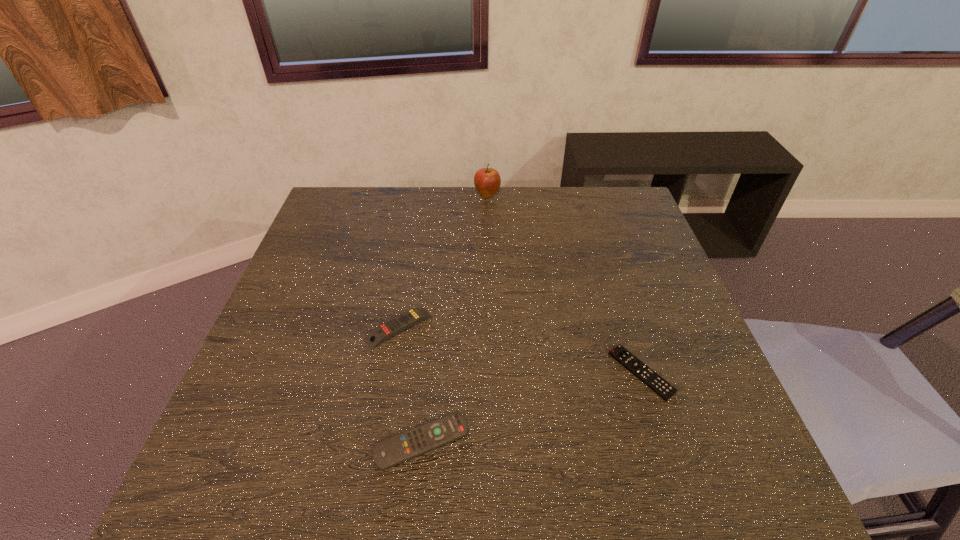
The width and height of the screenshot is (960, 540). In order to click on the second object from right to left in this screenshot , I will do `click(487, 181)`.

Image resolution: width=960 pixels, height=540 pixels. I want to click on apple, so [x=487, y=181].

Find the location of a particular element. The width and height of the screenshot is (960, 540). the tallest remote control is located at coordinates (390, 328).

The height and width of the screenshot is (540, 960). Identify the location of the nearest object. [x=392, y=451].

You are a GUI agent. You are given a task and a screenshot of the screen. Output one action in this format:
    pyautogui.click(x=<x>, y=<y>)
    Task: Click on the third tallest object
    The width and height of the screenshot is (960, 540).
    Given the screenshot: What is the action you would take?
    pyautogui.click(x=392, y=451)

The width and height of the screenshot is (960, 540). Identify the location of the shortest remote control. (660, 386).

Where is `the rightmost remote control`? The height and width of the screenshot is (540, 960). the rightmost remote control is located at coordinates (660, 386).

Locate an element on the screen. This screenshot has height=540, width=960. vacant space located on the front of the third object from left to right is located at coordinates (488, 237).

Locate an element on the screen. The width and height of the screenshot is (960, 540). vacant area situated 0.380m on the right of the tallest remote control is located at coordinates pyautogui.click(x=593, y=328).

This screenshot has width=960, height=540. What are the coordinates of `vacant position located 0.180m on the left of the second shortest remote control` in the screenshot? It's located at (279, 441).